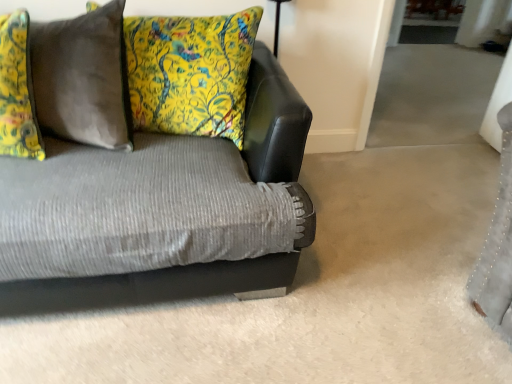
Question: From the image's perspective, is velvet gray pillow at upper left, the 2th pillow positioned from the left, above or below textured gray couch at center?

Choices:
 (A) below
 (B) above

Answer: (B)

Question: Considering the positions of velvet gray pillow at upper left, the 2th pillow positioned from the left, and textured gray couch at center in the image, is velvet gray pillow at upper left, the 2th pillow positioned from the left, taller or shorter than textured gray couch at center?

Choices:
 (A) short
 (B) tall

Answer: (A)

Question: Estimate the real-world distances between objects in this image. Which object is farther from the textured gray couch at center?

Choices:
 (A) yellow floral cushion at upper left, the 1th pillow positioned from the right
 (B) floral fabric pillow at left, the 3th pillow from the right
 (C) velvet gray pillow at upper left, the 2th pillow positioned from the left

Answer: (A)

Question: Which of these objects is positioned farthest from the yellow floral cushion at upper left, the third pillow viewed from the left?

Choices:
 (A) textured gray couch at center
 (B) velvet gray pillow at upper left, the 2th pillow positioned from the left
 (C) floral fabric pillow at left, the 3th pillow from the right

Answer: (A)